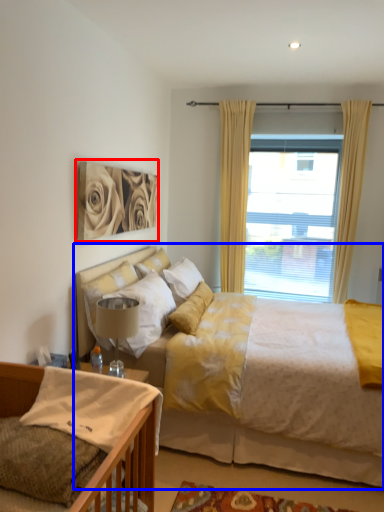
Question: Among these objects, which one is farthest to the camera, picture frame (highlighted by a red box) or bed (highlighted by a blue box)?

Choices:
 (A) picture frame
 (B) bed

Answer: (A)